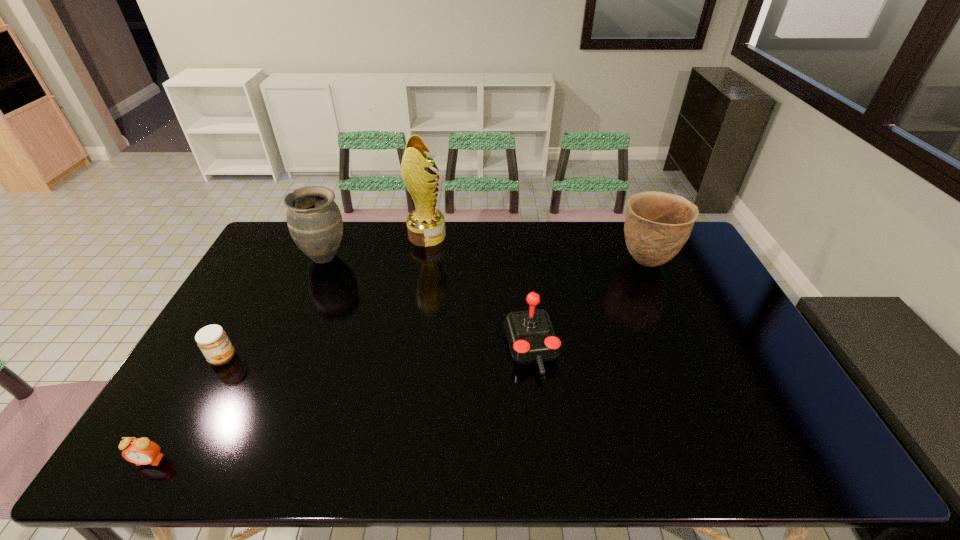
Find the location of a particular element. free space that satisfies the following two spatial constraints: 1. on the front-facing side of the award; 2. on the back side of the fifth object from left to right is located at coordinates (410, 349).

This screenshot has width=960, height=540. Find the location of `free space in the image that satisfies the following two spatial constraints: 1. on the front-facing side of the fourth object from left to right; 2. on the back side of the third shortest object`. free space in the image that satisfies the following two spatial constraints: 1. on the front-facing side of the fourth object from left to right; 2. on the back side of the third shortest object is located at coordinates (410, 349).

Identify the location of free spot that satisfies the following two spatial constraints: 1. on the front-facing side of the third object from right to left; 2. on the back side of the pottery. The image size is (960, 540). (423, 262).

The width and height of the screenshot is (960, 540). Identify the location of vacant space that satisfies the following two spatial constraints: 1. on the front label of the jam; 2. on the face of the nearest object. (166, 461).

The height and width of the screenshot is (540, 960). What are the coordinates of `free space in the image that satisfies the following two spatial constraints: 1. on the front label of the jam; 2. on the face of the alarm clock` in the screenshot? It's located at (166, 461).

This screenshot has height=540, width=960. Find the location of `free space that satisfies the following two spatial constraints: 1. on the front side of the rightmost object; 2. on the front label of the jam`. free space that satisfies the following two spatial constraints: 1. on the front side of the rightmost object; 2. on the front label of the jam is located at coordinates (689, 358).

Where is `free space that satisfies the following two spatial constraints: 1. on the front-facing side of the award; 2. on the face of the alarm clock`? Image resolution: width=960 pixels, height=540 pixels. free space that satisfies the following two spatial constraints: 1. on the front-facing side of the award; 2. on the face of the alarm clock is located at coordinates (393, 461).